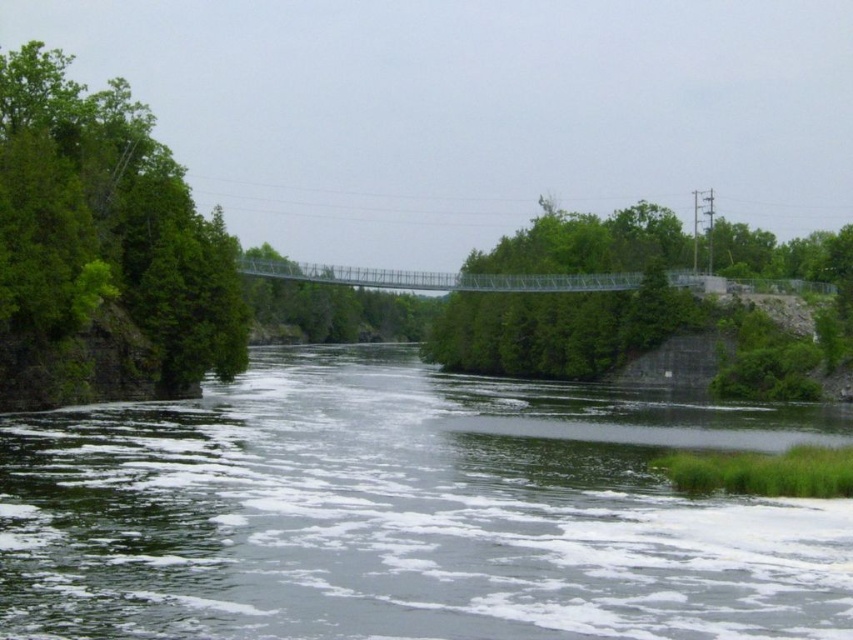
Question: Does greenish-gray water at center have a greater width compared to green leafy tree at right?

Choices:
 (A) yes
 (B) no

Answer: (B)

Question: Does green leafy tree at left appear over green leafy tree at right?

Choices:
 (A) no
 (B) yes

Answer: (A)

Question: Which of the following is the closest to the observer?

Choices:
 (A) greenish-gray water at center
 (B) green leafy tree at right
 (C) green leafy tree at left

Answer: (A)

Question: Which point is closer to the camera taking this photo?

Choices:
 (A) (468, 356)
 (B) (13, 540)
 (C) (24, 45)

Answer: (B)

Question: Does greenish-gray water at center appear under green leafy tree at right?

Choices:
 (A) no
 (B) yes

Answer: (B)

Question: Estimate the real-world distances between objects in this image. Which object is closer to the green leafy tree at left?

Choices:
 (A) green leafy tree at right
 (B) greenish-gray water at center

Answer: (B)